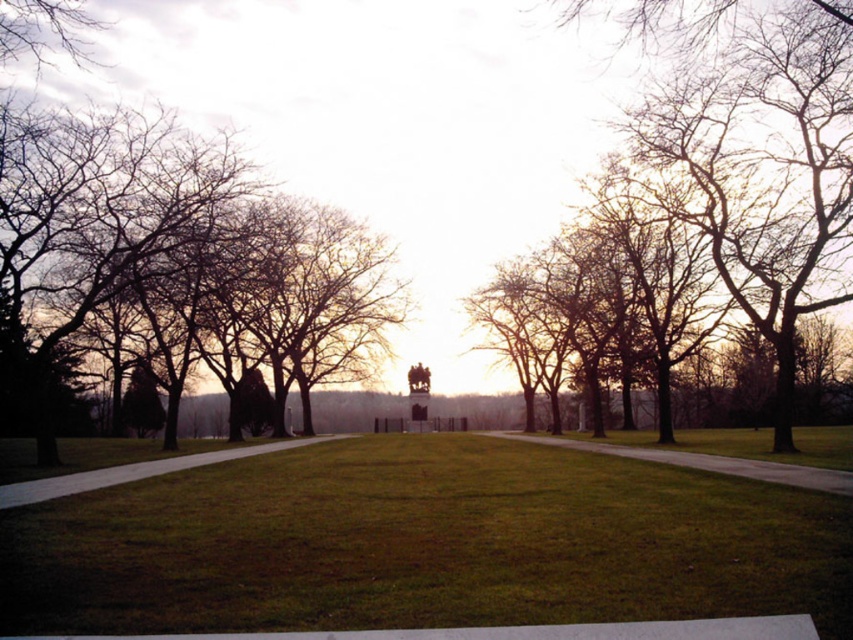
Based on the photo, which is more to the right, brown leafless tree at left or grassy sidewalk at center?

grassy sidewalk at center is more to the right.

Can you confirm if brown leafless tree at left is thinner than grassy sidewalk at center?

In fact, brown leafless tree at left might be wider than grassy sidewalk at center.

Which is behind, point (149, 156) or point (787, 461)?

The point (149, 156) is more distant.

This screenshot has width=853, height=640. What are the coordinates of `brown leafless tree at left` in the screenshot? It's located at (94, 221).

This screenshot has width=853, height=640. What do you see at coordinates (763, 172) in the screenshot?
I see `bare branches at center` at bounding box center [763, 172].

Locate an element on the screen. This screenshot has height=640, width=853. bare branches at center is located at coordinates (763, 172).

What do you see at coordinates (703, 461) in the screenshot?
I see `grassy sidewalk at center` at bounding box center [703, 461].

How much distance is there between grassy sidewalk at center and smooth concrete path at lower left?

A distance of 57.42 feet exists between grassy sidewalk at center and smooth concrete path at lower left.

Where is `grassy sidewalk at center`? grassy sidewalk at center is located at coordinates (703, 461).